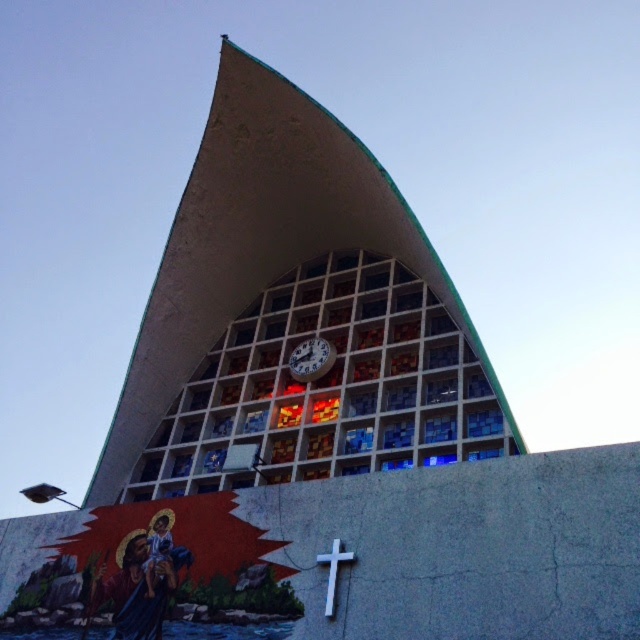
Question: Which is nearer to the stained glass at center?

Choices:
 (A) white matte cross at center
 (B) metallic clock at center

Answer: (B)

Question: Can you confirm if metallic clock at center is positioned below white matte cross at center?

Choices:
 (A) no
 (B) yes

Answer: (A)

Question: Estimate the real-world distances between objects in this image. Which object is closer to the white matte cross at center?

Choices:
 (A) stained glass at center
 (B) metallic clock at center

Answer: (A)

Question: Among these points, which one is farthest from the camera?

Choices:
 (A) (326, 586)
 (B) (292, 355)
 (C) (316, 381)

Answer: (B)

Question: Does metallic clock at center appear over white matte cross at center?

Choices:
 (A) no
 (B) yes

Answer: (B)

Question: Is metallic clock at center closer to the viewer compared to white matte cross at center?

Choices:
 (A) yes
 (B) no

Answer: (B)